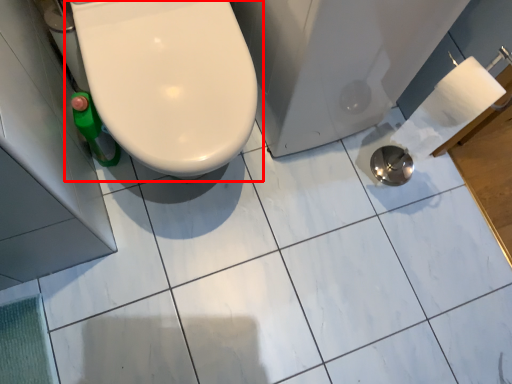
Question: Where is toilet (annotated by the red box) located in relation to bath in the image?

Choices:
 (A) right
 (B) left

Answer: (B)